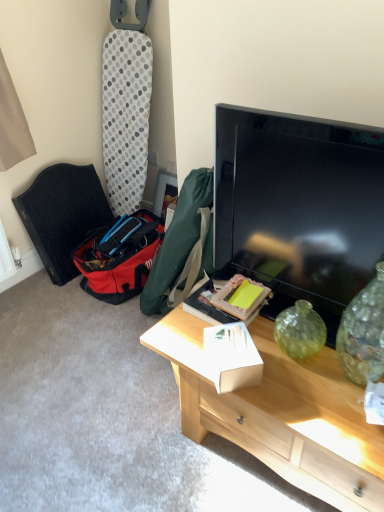
In order to face light wood desk at center, should I rotate leftwards or rightwards?

To face it directly, rotate right by 13.101 degrees.

What is the approximate height of white cardboard box at center, acting as the second box starting from the front?

white cardboard box at center, acting as the second box starting from the front, is 2.29 inches tall.

Where is `white cardboard box at center, acting as the second box starting from the front`? The image size is (384, 512). white cardboard box at center, acting as the second box starting from the front is located at coordinates (207, 306).

Describe the element at coordinates (232, 356) in the screenshot. I see `white cardboard box at center, arranged as the first box when viewed from the front` at that location.

This screenshot has height=512, width=384. Describe the element at coordinates (299, 206) in the screenshot. I see `flat screen tv at center` at that location.

Locate an element on the screen. Image resolution: width=384 pixels, height=512 pixels. light wood desk at center is located at coordinates (281, 413).

Between white cardboard box at center, arranged as the second box when viewed from the back, and flat screen tv at center, which one has smaller size?

Smaller between the two is white cardboard box at center, arranged as the second box when viewed from the back.

From a real-world perspective, is white cardboard box at center, arranged as the second box when viewed from the back, positioned under flat screen tv at center based on gravity?

Yes, from a real-world perspective, white cardboard box at center, arranged as the second box when viewed from the back, is beneath flat screen tv at center.

Where is `television that appears above the white cardboard box at center, arranged as the first box when viewed from the front (from a real-world perspective)`? television that appears above the white cardboard box at center, arranged as the first box when viewed from the front (from a real-world perspective) is located at coordinates (299, 206).

Between white cardboard box at center, arranged as the first box when viewed from the front, and flat screen tv at center, which one has less height?

Standing shorter between the two is white cardboard box at center, arranged as the first box when viewed from the front.

Considering the relative sizes of flat screen tv at center and white cardboard box at center, arranged as the second box when viewed from the back, in the image provided, is flat screen tv at center bigger than white cardboard box at center, arranged as the second box when viewed from the back,?

Correct, flat screen tv at center is larger in size than white cardboard box at center, arranged as the second box when viewed from the back.

Is flat screen tv at center positioned with its back to white cardboard box at center, arranged as the first box when viewed from the front?

flat screen tv at center does not have its back to white cardboard box at center, arranged as the first box when viewed from the front.

Which point is more distant from viewer, (297,284) or (234,364)?

The point (297,284) is behind.

Looking at this image, is wooden picture frame at center wider than white cardboard box at center, acting as the second box starting from the front?

No.

Is the depth of wooden picture frame at center less than that of white cardboard box at center, which ranks as the 1th box in back-to-front order?

No, it is not.

Considering the relative sizes of wooden picture frame at center and white cardboard box at center, acting as the second box starting from the front, in the image provided, is wooden picture frame at center bigger than white cardboard box at center, acting as the second box starting from the front,?

Correct, wooden picture frame at center is larger in size than white cardboard box at center, acting as the second box starting from the front.

Looking at this image, from a real-world perspective, who is located lower, wooden picture frame at center or white cardboard box at center, which ranks as the 1th box in back-to-front order?

wooden picture frame at center.

Is white cardboard box at center, acting as the second box starting from the front, positioned behind light wood desk at center?

Yes, white cardboard box at center, acting as the second box starting from the front, is behind light wood desk at center.

How different are the orientations of white cardboard box at center, acting as the second box starting from the front, and light wood desk at center in degrees?

There is a 5.68-degree angle between the facing directions of white cardboard box at center, acting as the second box starting from the front, and light wood desk at center.

From a real-world perspective, does white cardboard box at center, acting as the second box starting from the front, stand above light wood desk at center?

Correct, in the physical world, white cardboard box at center, acting as the second box starting from the front, is higher than light wood desk at center.

Considering the sizes of objects white cardboard box at center, acting as the second box starting from the front, and light wood desk at center in the image provided, who is bigger, white cardboard box at center, acting as the second box starting from the front, or light wood desk at center?

light wood desk at center.

Relative to light wood desk at center, is flat screen tv at center in front or behind?

flat screen tv at center is in front of light wood desk at center.

How many degrees apart are the facing directions of flat screen tv at center and light wood desk at center?

There is a 2.17-degree angle between the facing directions of flat screen tv at center and light wood desk at center.

In the scene shown: From a real-world perspective, is flat screen tv at center physically located above or below light wood desk at center?

Clearly, from a real-world perspective, flat screen tv at center is above light wood desk at center.

Considering the points (235, 264) and (321, 496), which point is in front, point (235, 264) or point (321, 496)?

The point (321, 496) is closer.

Is light wood desk at center in front of or behind white cardboard box at center, arranged as the second box when viewed from the back, in the image?

Clearly, light wood desk at center is in front of white cardboard box at center, arranged as the second box when viewed from the back.

Considering the relative sizes of light wood desk at center and white cardboard box at center, arranged as the second box when viewed from the back, in the image provided, is light wood desk at center smaller than white cardboard box at center, arranged as the second box when viewed from the back,?

No, light wood desk at center is not smaller than white cardboard box at center, arranged as the second box when viewed from the back.

Looking at this image, could white cardboard box at center, arranged as the first box when viewed from the front, be considered to be inside light wood desk at center?

No, white cardboard box at center, arranged as the first box when viewed from the front, is not a part of light wood desk at center.

How far apart are light wood desk at center and white cardboard box at center, arranged as the first box when viewed from the front?

light wood desk at center is 6.94 inches from white cardboard box at center, arranged as the first box when viewed from the front.

Is light wood desk at center not within flat screen tv at center?

Yes, light wood desk at center is not within flat screen tv at center.

From the image's perspective, which object appears higher, light wood desk at center or flat screen tv at center?

flat screen tv at center, from the image's perspective.

This screenshot has height=512, width=384. Identify the location of desk located below the flat screen tv at center (from the image's perspective). (281, 413).

Where is `television on the right side of white cardboard box at center, arranged as the second box when viewed from the back`? television on the right side of white cardboard box at center, arranged as the second box when viewed from the back is located at coordinates (299, 206).

The height and width of the screenshot is (512, 384). Find the location of `television above the white cardboard box at center, arranged as the first box when viewed from the front (from a real-world perspective)`. television above the white cardboard box at center, arranged as the first box when viewed from the front (from a real-world perspective) is located at coordinates (299, 206).

Which object lies further to the anchor point white cardboard box at center, arranged as the second box when viewed from the back, flat screen tv at center or wooden picture frame at center?

wooden picture frame at center lies further to white cardboard box at center, arranged as the second box when viewed from the back, than the other object.

Considering their positions, is light wood desk at center positioned further to flat screen tv at center than black fabric folding chair at left?

black fabric folding chair at left.

Based on the photo, estimate the real-world distances between objects in this image. Which object is further from white cardboard box at center, arranged as the first box when viewed from the front, black fabric folding chair at left or light wood desk at center?

Based on the image, black fabric folding chair at left appears to be further to white cardboard box at center, arranged as the first box when viewed from the front.

Which object lies nearer to the anchor point wooden picture frame at center, white cardboard box at center, acting as the second box starting from the front, or black fabric folding chair at left?

black fabric folding chair at left is closer to wooden picture frame at center.

Based on their spatial positions, is black fabric folding chair at left or white cardboard box at center, arranged as the first box when viewed from the front, further from wooden picture frame at center?

Based on the image, white cardboard box at center, arranged as the first box when viewed from the front, appears to be further to wooden picture frame at center.

Based on their spatial positions, is white cardboard box at center, arranged as the second box when viewed from the back, or flat screen tv at center further from light wood desk at center?

flat screen tv at center is positioned further to the anchor light wood desk at center.

Considering their positions, is black fabric folding chair at left positioned further to light wood desk at center than flat screen tv at center?

The object further to light wood desk at center is black fabric folding chair at left.

Estimate the real-world distances between objects in this image. Which object is further from black fabric folding chair at left, white cardboard box at center, acting as the second box starting from the front, or wooden picture frame at center?

Among the two, white cardboard box at center, acting as the second box starting from the front, is located further to black fabric folding chair at left.

Find the location of a particular element. box between light wood desk at center and white cardboard box at center, which ranks as the 1th box in back-to-front order, from front to back is located at coordinates (232, 356).

At what (x,y) coordinates should I click in order to perform the action: click on folding chair between white cardboard box at center, which ranks as the 1th box in back-to-front order, and wooden picture frame at center from front to back. Please return your answer as a coordinate pair (x, y). This screenshot has width=384, height=512. Looking at the image, I should click on (62, 215).

Locate an element on the screen. The height and width of the screenshot is (512, 384). box between white cardboard box at center, arranged as the first box when viewed from the front, and wooden picture frame at center from front to back is located at coordinates (207, 306).

Find the location of a particular element. The image size is (384, 512). desk between flat screen tv at center and wooden picture frame at center in the front-back direction is located at coordinates click(x=281, y=413).